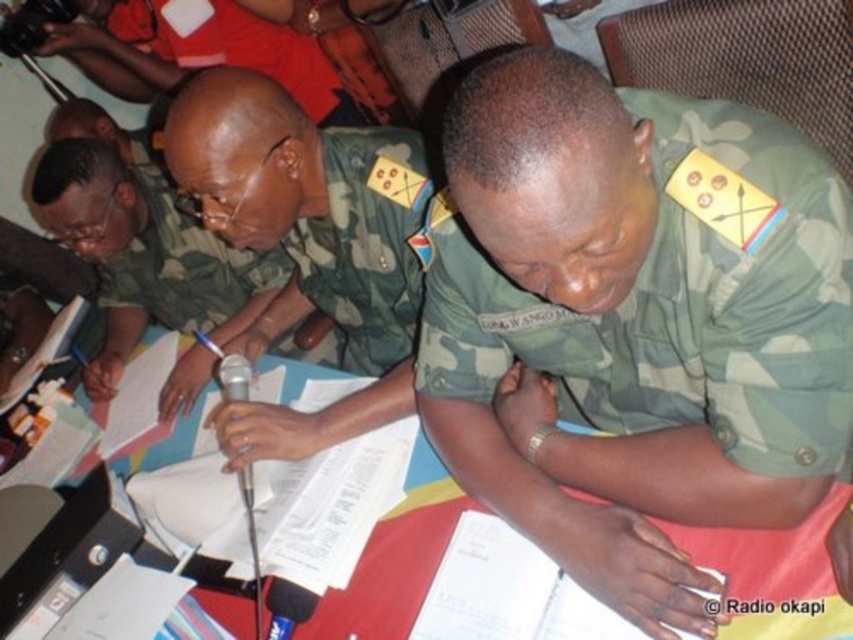
Question: Is camo fabric uniform at center behind camouflage fabric uniform at center?

Choices:
 (A) no
 (B) yes

Answer: (A)

Question: Among these objects, which one is nearest to the camera?

Choices:
 (A) red plastic table at center
 (B) metallic silver microphone at center
 (C) camouflage fabric uniform at center

Answer: (A)

Question: Which object appears farthest from the camera in this image?

Choices:
 (A) red cotton shirt at upper center
 (B) metallic silver microphone at center
 (C) camouflage fabric uniform at center

Answer: (A)

Question: Where is camo fabric uniform at center located in relation to metallic silver microphone at center in the image?

Choices:
 (A) right
 (B) left

Answer: (A)

Question: Which of the following is the closest to the observer?

Choices:
 (A) red plastic table at center
 (B) metallic silver microphone at center
 (C) red cotton shirt at upper center
 (D) camouflage fabric uniform at center

Answer: (A)

Question: Where is red cotton shirt at upper center located in relation to metallic silver microphone at center in the image?

Choices:
 (A) left
 (B) right

Answer: (A)